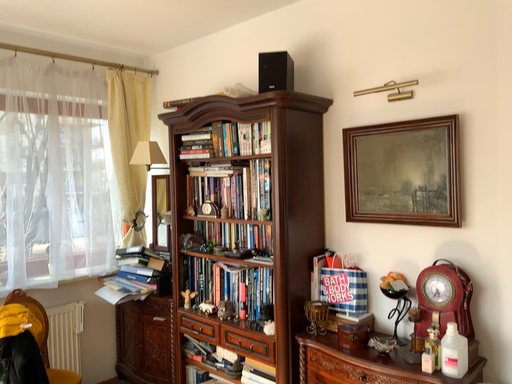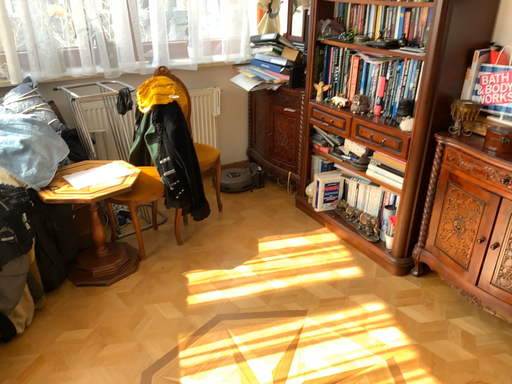
Question: Which way did the camera rotate in the video?

Choices:
 (A) rotated upward
 (B) rotated downward

Answer: (B)